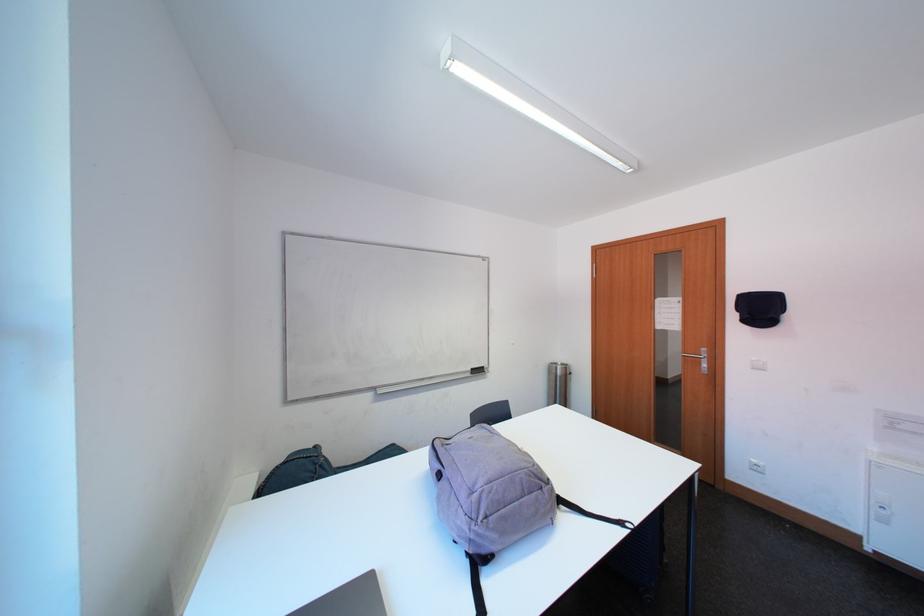
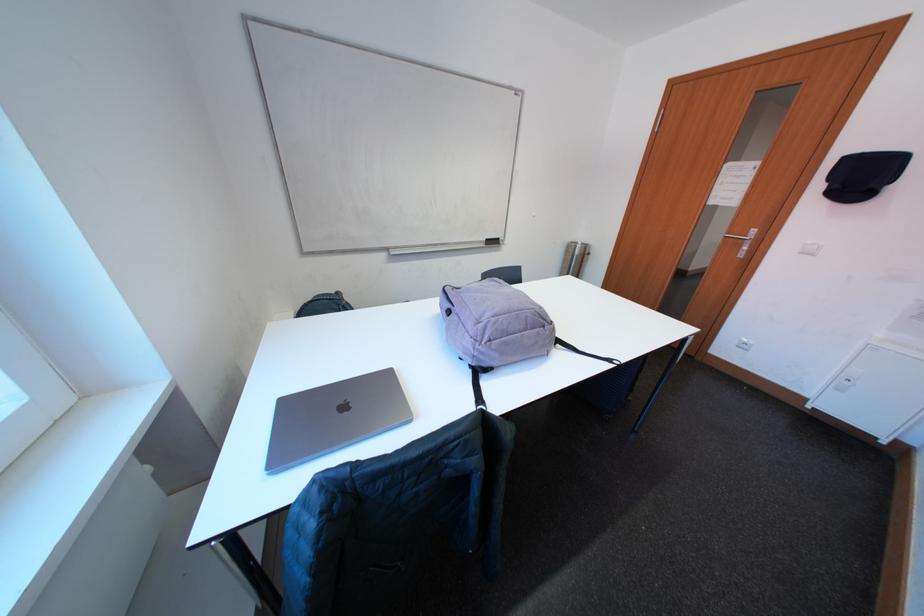
Question: The images are taken continuously from a first-person perspective. In which direction is your viewpoint rotating?

Choices:
 (A) Left
 (B) Right
 (C) Up
 (D) Down

Answer: (D)